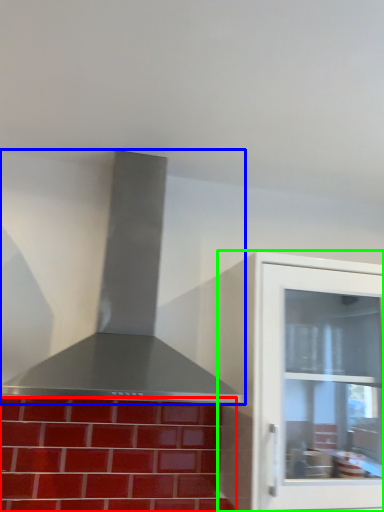
Question: Considering the real-world distances, which object is farthest from brickwork (highlighted by a red box)? vent (highlighted by a blue box) or cabinetry (highlighted by a green box)?

Choices:
 (A) vent
 (B) cabinetry

Answer: (A)